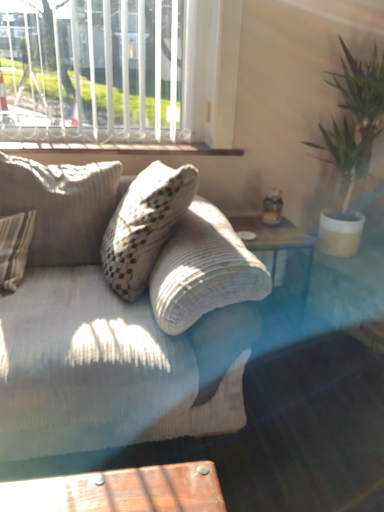
Question: From the image's perspective, is transparent glass plate at upper right beneath textured beige pillow at left?

Choices:
 (A) yes
 (B) no

Answer: (A)

Question: Can you confirm if transparent glass plate at upper right is positioned to the right of textured beige pillow at left?

Choices:
 (A) no
 (B) yes

Answer: (B)

Question: Is transparent glass plate at upper right taller than textured beige pillow at left?

Choices:
 (A) no
 (B) yes

Answer: (A)

Question: Is transparent glass plate at upper right at the left side of textured beige pillow at left?

Choices:
 (A) no
 (B) yes

Answer: (A)

Question: Is transparent glass plate at upper right bigger than textured beige pillow at left?

Choices:
 (A) yes
 (B) no

Answer: (B)

Question: Considering the positions of transparent glass plate at upper right and white painted wood at upper center in the image, is transparent glass plate at upper right bigger or smaller than white painted wood at upper center?

Choices:
 (A) big
 (B) small

Answer: (B)

Question: Considering the positions of transparent glass plate at upper right and white painted wood at upper center in the image, is transparent glass plate at upper right taller or shorter than white painted wood at upper center?

Choices:
 (A) short
 (B) tall

Answer: (A)

Question: Is transparent glass plate at upper right situated inside white painted wood at upper center or outside?

Choices:
 (A) outside
 (B) inside

Answer: (A)

Question: Is point (248, 231) positioned closer to the camera than point (132, 146)?

Choices:
 (A) closer
 (B) farther

Answer: (A)

Question: Considering the positions of white textured window at upper left and textured beige pillow at left in the image, is white textured window at upper left taller or shorter than textured beige pillow at left?

Choices:
 (A) short
 (B) tall

Answer: (B)

Question: Based on their sizes in the image, would you say white textured window at upper left is bigger or smaller than textured beige pillow at left?

Choices:
 (A) small
 (B) big

Answer: (A)

Question: From a real-world perspective, is white textured window at upper left physically located above or below textured beige pillow at left?

Choices:
 (A) above
 (B) below

Answer: (A)

Question: Relative to textured beige pillow at left, is white textured window at upper left in front or behind?

Choices:
 (A) front
 (B) behind

Answer: (B)

Question: Relative to transparent glass plate at upper right, is textured beige pillow at left in front or behind?

Choices:
 (A) front
 (B) behind

Answer: (A)

Question: Is textured beige pillow at left bigger or smaller than transparent glass plate at upper right?

Choices:
 (A) big
 (B) small

Answer: (A)